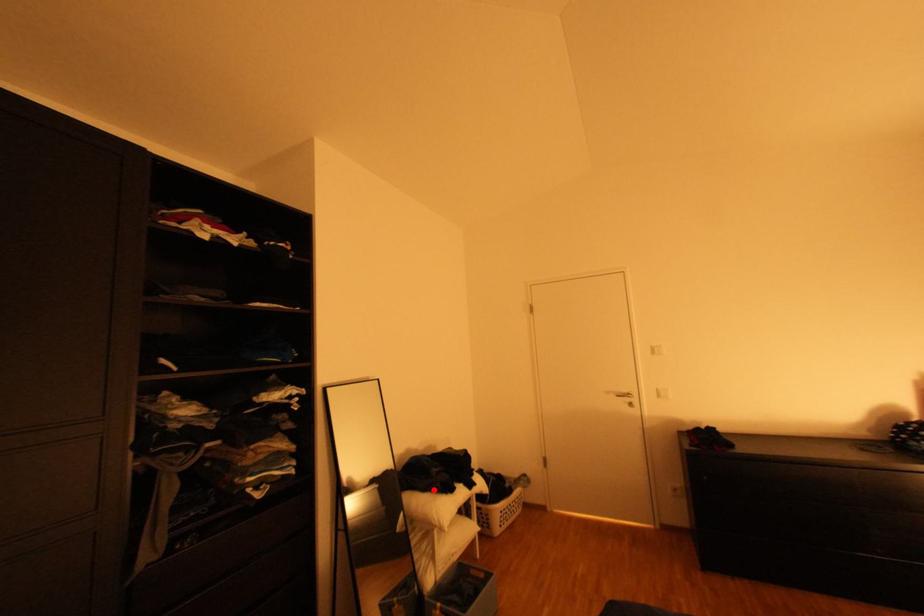
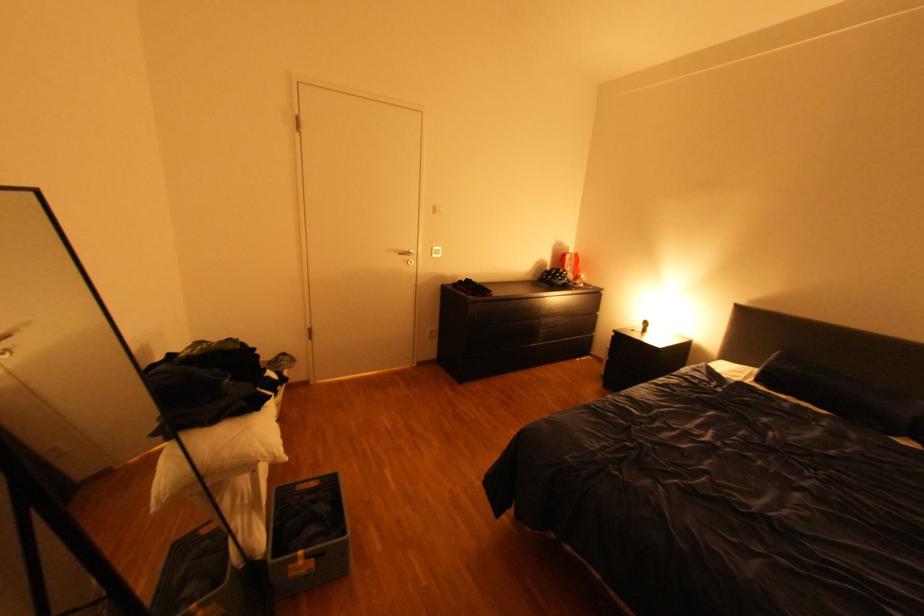
Find the pixel in the second image that matches the highlighted location in the first image.

(223, 421)